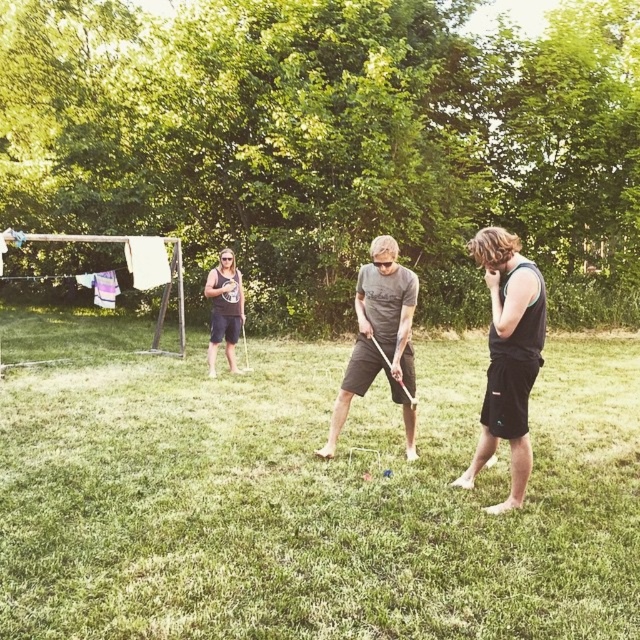
Is point (396, 300) farther from viewer compared to point (100, 275)?

No, (396, 300) is closer to viewer.

Between point (364, 273) and point (81, 276), which one is positioned in front?

Point (364, 273) is more forward.

This screenshot has height=640, width=640. What do you see at coordinates (380, 339) in the screenshot?
I see `dark gray t-shirt at center` at bounding box center [380, 339].

This screenshot has height=640, width=640. Identify the location of dark gray t-shirt at center. (380, 339).

This screenshot has height=640, width=640. In order to click on black matte tank top at right in this screenshot , I will do `click(508, 356)`.

Does point (541, 308) come farther from viewer compared to point (161, 268)?

No, (541, 308) is in front of (161, 268).

At what (x,y) coordinates should I click in order to perform the action: click on black matte tank top at right. Please return your answer as a coordinate pair (x, y). Looking at the image, I should click on coord(508,356).

Is green grass at center wider than black matte tank top at right?

Yes.

Between green grass at center and black matte tank top at right, which one has less height?

green grass at center is shorter.

This screenshot has width=640, height=640. What do you see at coordinates (305, 493) in the screenshot? I see `green grass at center` at bounding box center [305, 493].

Locate an element on the screen. This screenshot has width=640, height=640. green grass at center is located at coordinates (305, 493).